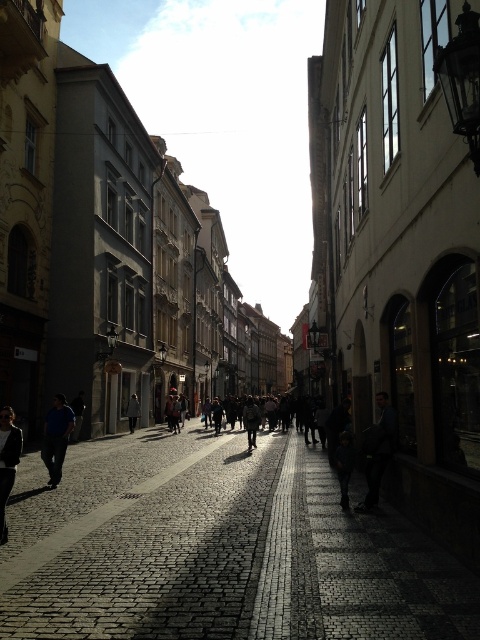
You are a street vendor who needs to decide where to set up your cart. You have two items to display on the cobblestone street. The dark blue jeans at lower right and the dark gray fabric coat at center. Which item takes up more space horizontally on the ground?

The dark gray fabric coat at center takes up more space horizontally on the ground because it is thicker than the dark blue jeans at lower right.

You are a tourist standing on the cobblestone street in the historic European city. You see the blue denim jeans at lower left and the dark gray sweater at lower left. Which item is closer to you?

The blue denim jeans at lower left is closer to you because it is further to the viewer than the dark gray sweater at lower left.

You are a photographer standing on a historic European street with cobblestone pavement. You notice two items of clothing in the scene. The first is a dark gray sweater at lower left, and the second is a dark gray fabric jacket at center. Which clothing item is closer to you?

The dark gray sweater at lower left is positioned over the dark gray fabric jacket at center, meaning it is closer to you.